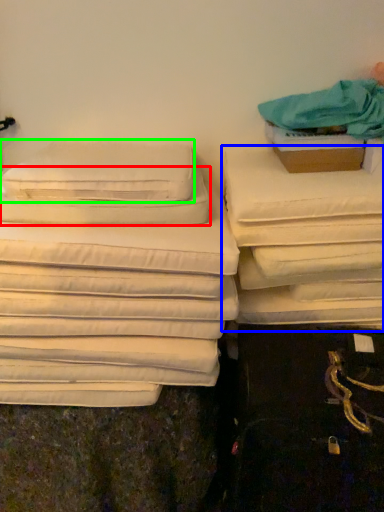
Question: Based on their relative distances, which object is farther from pillow (highlighted by a red box)? Choose from furniture (highlighted by a blue box) and pillow (highlighted by a green box).

Choices:
 (A) furniture
 (B) pillow

Answer: (A)